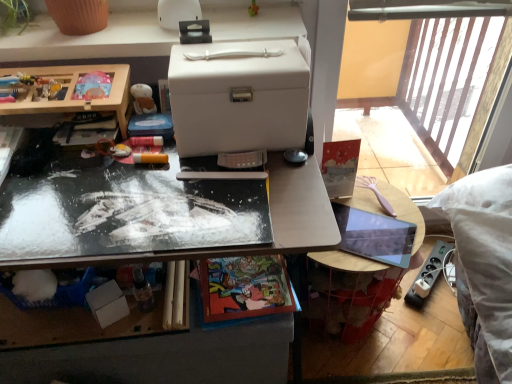
Question: Considering the positions of metallic reflective desk at center, which is counted as the first desk, starting from the bottom, and wooden toy box at left, which is counted as the 2th desk, starting from the bottom, in the image, is metallic reflective desk at center, which is counted as the first desk, starting from the bottom, bigger or smaller than wooden toy box at left, which is counted as the 2th desk, starting from the bottom,?

Choices:
 (A) big
 (B) small

Answer: (A)

Question: From the image's perspective, is metallic reflective desk at center, which appears as the 3th desk when viewed from the top, positioned above or below wooden toy box at left, which is counted as the 2th desk, starting from the bottom?

Choices:
 (A) below
 (B) above

Answer: (A)

Question: Which is nearer to the white plastic storage box at upper center, the first desk viewed from the top?

Choices:
 (A) metallic reflective desk at center, which is counted as the first desk, starting from the bottom
 (B) wooden toy box at left, which is counted as the 2th desk, starting from the bottom
 (C) smooth wooden table at right
 (D) white matte box at center

Answer: (B)

Question: Which object is the farthest from the metallic reflective desk at center, which appears as the 3th desk when viewed from the top?

Choices:
 (A) white matte box at center
 (B) smooth wooden table at right
 (C) wooden toy box at left, which is counted as the 2th desk, starting from the bottom
 (D) white plastic storage box at upper center, the first desk viewed from the top

Answer: (D)